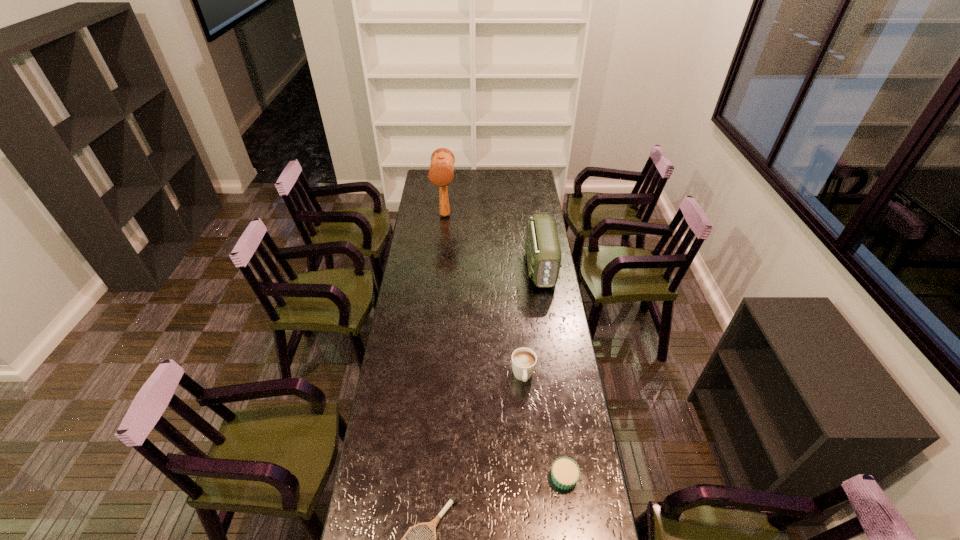
You are a GUI agent. You are given a task and a screenshot of the screen. Output one action in this format:
    pyautogui.click(x=<x>, y=<y>)
    Task: Click on the free location located with the handle on the side of the third nearest object
    The width and height of the screenshot is (960, 540).
    Given the screenshot: What is the action you would take?
    pyautogui.click(x=526, y=409)

Identify the location of free region located on the left of the cupcake. (492, 477).

Identify the location of object at the left edge. (441, 170).

You are a GUI agent. You are given a task and a screenshot of the screen. Output one action in this format:
    pyautogui.click(x=<x>, y=<y>)
    Task: Click on the radio_receiver located at the right edge
    The width and height of the screenshot is (960, 540).
    Given the screenshot: What is the action you would take?
    pyautogui.click(x=542, y=246)

Find the location of a particular element. The width and height of the screenshot is (960, 540). cappuccino situated at the right edge is located at coordinates (524, 360).

Locate an element on the screen. The height and width of the screenshot is (540, 960). cupcake that is at the right edge is located at coordinates (565, 473).

Locate an element on the screen. The width and height of the screenshot is (960, 540). free spot at the far edge of the desktop is located at coordinates (492, 186).

I want to click on free space at the left edge of the desktop, so click(x=412, y=372).

This screenshot has width=960, height=540. Identify the location of free space at the right edge of the desktop. (521, 228).

The image size is (960, 540). Identify the location of vacant area that lies between the cupcake and the mallet. (504, 346).